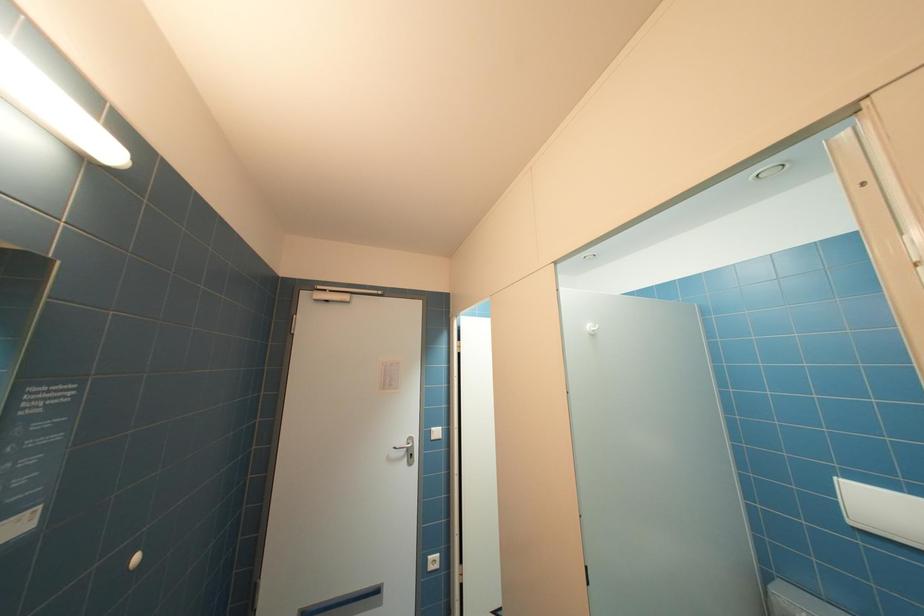
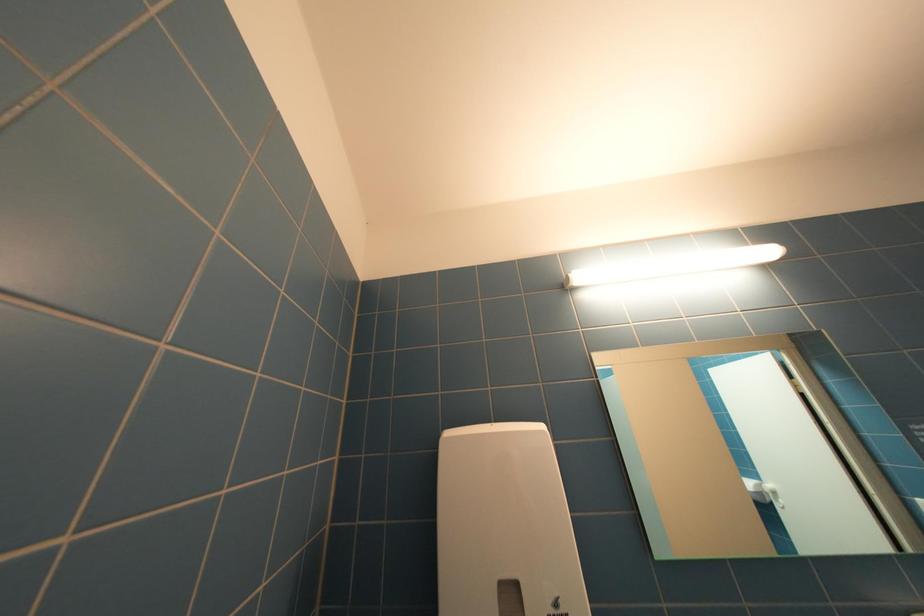
How did the camera likely rotate?

The rotation direction of the camera is left-up.